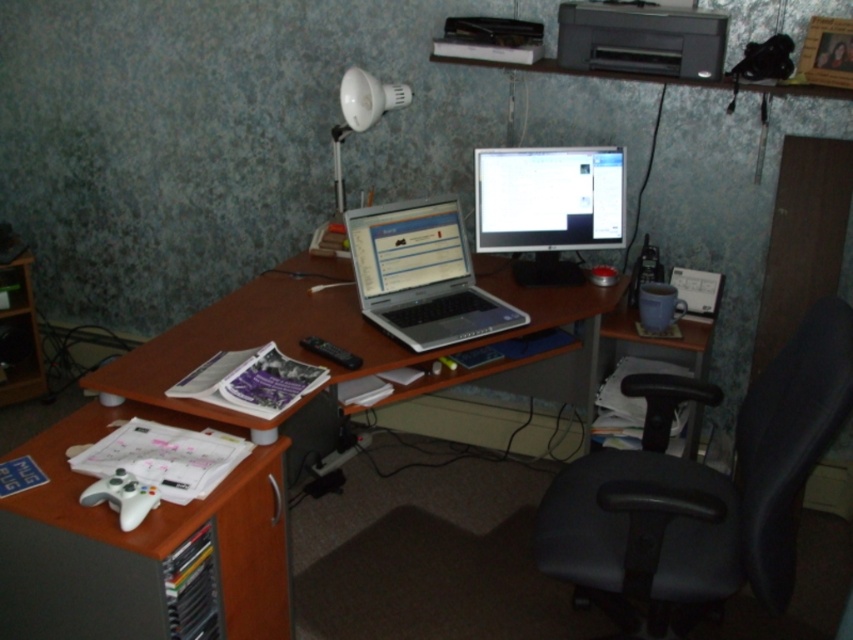
Is matte black monitor at center smaller than matte gray printer at upper right?

Incorrect, matte black monitor at center is not smaller in size than matte gray printer at upper right.

Does point (476, 161) lie in front of point (624, 28)?

No, (476, 161) is further to viewer.

Identify the location of matte black monitor at center. (549, 205).

Where is `matte black monitor at center`? The image size is (853, 640). matte black monitor at center is located at coordinates (549, 205).

Who is positioned more to the left, white plastic game controller at lower left or matte black monitor at center?

white plastic game controller at lower left is more to the left.

Describe the element at coordinates (137, 545) in the screenshot. I see `white plastic game controller at lower left` at that location.

Is point (287, 596) closer to viewer compared to point (547, 205)?

Yes, point (287, 596) is closer to viewer.

Identify the location of white plastic game controller at lower left. (137, 545).

Does white plastic game controller at lower left appear on the right side of silver/black laptop at center?

In fact, white plastic game controller at lower left is to the left of silver/black laptop at center.

Is the position of white plastic game controller at lower left less distant than that of silver/black laptop at center?

Yes.

Is point (62, 593) behind point (422, 262)?

No, (62, 593) is in front of (422, 262).

Where is `white plastic game controller at lower left`? The image size is (853, 640). white plastic game controller at lower left is located at coordinates point(137,545).